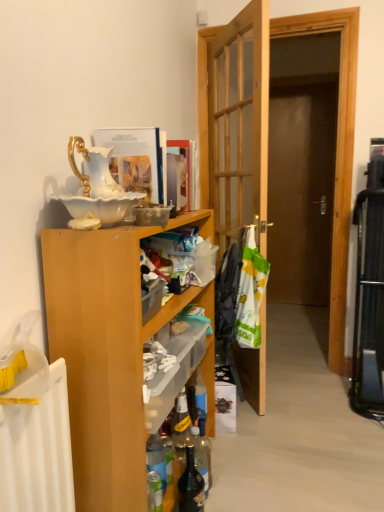
Question: Is translucent glass bottle at lower center, marked as the second bottle in a right-to-left arrangement, outside of dark glass bottle at lower center, which is the 1th bottle in right-to-left order?

Choices:
 (A) yes
 (B) no

Answer: (A)

Question: Considering the relative positions of translucent glass bottle at lower center, which appears as the first bottle when viewed from the left, and dark glass bottle at lower center, positioned as the 2th bottle in left-to-right order, in the image provided, is translucent glass bottle at lower center, which appears as the first bottle when viewed from the left, behind dark glass bottle at lower center, positioned as the 2th bottle in left-to-right order,?

Choices:
 (A) yes
 (B) no

Answer: (A)

Question: Can you confirm if translucent glass bottle at lower center, marked as the second bottle in a right-to-left arrangement, is shorter than dark glass bottle at lower center, which is the 1th bottle in right-to-left order?

Choices:
 (A) yes
 (B) no

Answer: (A)

Question: Is there a large distance between translucent glass bottle at lower center, which appears as the first bottle when viewed from the left, and dark glass bottle at lower center, which is the 1th bottle in right-to-left order?

Choices:
 (A) no
 (B) yes

Answer: (A)

Question: Can you confirm if translucent glass bottle at lower center, which appears as the first bottle when viewed from the left, is bigger than dark glass bottle at lower center, positioned as the 2th bottle in left-to-right order?

Choices:
 (A) no
 (B) yes

Answer: (A)

Question: From the image's perspective, is translucent glass bottle at lower center, marked as the second bottle in a right-to-left arrangement, positioned above or below matte paper magazine at upper center, the 2th magazine from the left?

Choices:
 (A) below
 (B) above

Answer: (A)

Question: Considering the positions of translucent glass bottle at lower center, which appears as the first bottle when viewed from the left, and matte paper magazine at upper center, the 1th magazine from the right, in the image, is translucent glass bottle at lower center, which appears as the first bottle when viewed from the left, taller or shorter than matte paper magazine at upper center, the 1th magazine from the right,?

Choices:
 (A) short
 (B) tall

Answer: (A)

Question: In terms of size, does translucent glass bottle at lower center, marked as the second bottle in a right-to-left arrangement, appear bigger or smaller than matte paper magazine at upper center, which is the first magazine in back-to-front order?

Choices:
 (A) small
 (B) big

Answer: (A)

Question: Considering their positions, is translucent glass bottle at lower center, marked as the second bottle in a right-to-left arrangement, located in front of or behind matte paper magazine at upper center, the second magazine in the front-to-back sequence?

Choices:
 (A) front
 (B) behind

Answer: (A)

Question: From the image's perspective, relative to matte paper magazine at upper center, the 1th magazine from the right, is translucent plastic shelf at center above or below?

Choices:
 (A) below
 (B) above

Answer: (A)

Question: In terms of width, does translucent plastic shelf at center look wider or thinner when compared to matte paper magazine at upper center, the 1th magazine from the right?

Choices:
 (A) wide
 (B) thin

Answer: (A)

Question: Would you say translucent plastic shelf at center is to the left or to the right of matte paper magazine at upper center, the 2th magazine from the left, in the picture?

Choices:
 (A) left
 (B) right

Answer: (A)

Question: From their relative heights in the image, would you say translucent plastic shelf at center is taller or shorter than matte paper magazine at upper center, the 1th magazine from the right?

Choices:
 (A) short
 (B) tall

Answer: (A)

Question: From their relative heights in the image, would you say translucent plastic shelf at center is taller or shorter than wooden door at center?

Choices:
 (A) short
 (B) tall

Answer: (A)

Question: From the image's perspective, is translucent plastic shelf at center located above or below wooden door at center?

Choices:
 (A) above
 (B) below

Answer: (B)